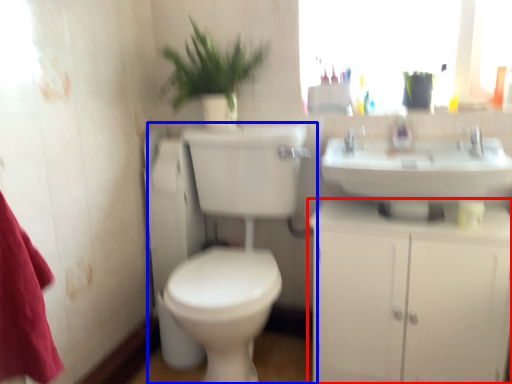
Question: Which point is further to the camera, bathroom cabinet (highlighted by a red box) or toilet (highlighted by a blue box)?

Choices:
 (A) bathroom cabinet
 (B) toilet

Answer: (A)